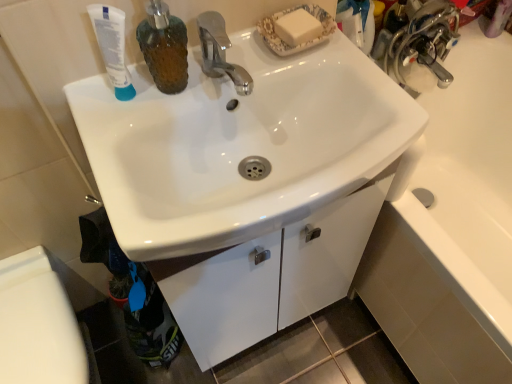
Identify the location of white glossy cabinet at lower center. (270, 276).

In order to face white glossy cabinet at lower center, should I rotate leftwards or rightwards?

A 3.086 degree turn to the left will do.

Describe the element at coordinates (112, 47) in the screenshot. I see `white matte tube at upper left` at that location.

The image size is (512, 384). In order to click on white glossy sink at center in this screenshot , I will do `click(239, 145)`.

Image resolution: width=512 pixels, height=384 pixels. I want to click on white glossy toilet bowl at lower left, so click(38, 324).

Is brown textured soap dispenser at upper left at the back of white glossy toilet bowl at lower left?

No, white glossy toilet bowl at lower left is not facing the opposite direction of brown textured soap dispenser at upper left.

Is white glossy toilet bowl at lower left shorter than brown textured soap dispenser at upper left?

Incorrect, the height of white glossy toilet bowl at lower left does not fall short of that of brown textured soap dispenser at upper left.

Is white glossy toilet bowl at lower left not close to brown textured soap dispenser at upper left?

white glossy toilet bowl at lower left is actually quite close to brown textured soap dispenser at upper left.

From the image's perspective, is white glossy toilet bowl at lower left on top of brown textured soap dispenser at upper left?

No, from the image's perspective, white glossy toilet bowl at lower left is not on top of brown textured soap dispenser at upper left.

How far apart are white matte tube at upper left and white glossy toilet bowl at lower left?

white matte tube at upper left is 21.80 inches away from white glossy toilet bowl at lower left.

Is white matte tube at upper left in front of or behind white glossy toilet bowl at lower left in the image?

white matte tube at upper left is in front of white glossy toilet bowl at lower left.

In terms of height, does white matte tube at upper left look taller or shorter compared to white glossy toilet bowl at lower left?

Considering their sizes, white matte tube at upper left has less height than white glossy toilet bowl at lower left.

In the scene shown: From a real-world perspective, is white glossy toilet bowl at lower left above or below white matte tube at upper left?

white glossy toilet bowl at lower left is situated lower than white matte tube at upper left in the real world.

Is white glossy toilet bowl at lower left bigger or smaller than white matte tube at upper left?

Considering their sizes, white glossy toilet bowl at lower left takes up more space than white matte tube at upper left.

From the image's perspective, who appears lower, white glossy toilet bowl at lower left or white matte tube at upper left?

From the image's view, white glossy toilet bowl at lower left is below.

Based on the photo, which is closer, (63, 317) or (110, 67)?

Positioned in front is point (110, 67).

In the image, is white glossy sink at center on the left side or the right side of white glossy toilet bowl at lower left?

In the image, white glossy sink at center appears on the right side of white glossy toilet bowl at lower left.

From the image's perspective, which is above, white glossy sink at center or white glossy toilet bowl at lower left?

From the image's view, white glossy sink at center is above.

Consider the image. Can you confirm if white glossy sink at center is thinner than white glossy toilet bowl at lower left?

No, white glossy sink at center is not thinner than white glossy toilet bowl at lower left.

Between point (164, 260) and point (47, 280), which one is positioned in front?

The point (164, 260) is more forward.

From a real-world perspective, is white glossy cabinet at lower center on top of white glossy toilet bowl at lower left?

No, from a real-world perspective, white glossy cabinet at lower center is not above white glossy toilet bowl at lower left.

How much distance is there between white glossy cabinet at lower center and white glossy toilet bowl at lower left?

white glossy cabinet at lower center and white glossy toilet bowl at lower left are 16.23 inches apart.

Is white glossy cabinet at lower center shorter than white glossy toilet bowl at lower left?

Correct, white glossy cabinet at lower center is not as tall as white glossy toilet bowl at lower left.

Considering the relative positions of white matte tube at upper left and brown textured soap dispenser at upper left in the image provided, is white matte tube at upper left to the right of brown textured soap dispenser at upper left from the viewer's perspective?

No.

Consider the image. Does white matte tube at upper left have a lesser width compared to brown textured soap dispenser at upper left?

Yes.

Looking at this image, how different are the orientations of white matte tube at upper left and brown textured soap dispenser at upper left in degrees?

white matte tube at upper left and brown textured soap dispenser at upper left are facing 0.00573 degrees away from each other.

From a real-world perspective, is white matte tube at upper left located beneath brown textured soap dispenser at upper left?

Yes, from a real-world perspective, white matte tube at upper left is beneath brown textured soap dispenser at upper left.

Looking at this image, is white glossy sink at center touching white matte tube at upper left?

No, white glossy sink at center is not making contact with white matte tube at upper left.

Is white glossy sink at center aimed at white matte tube at upper left?

No, white glossy sink at center does not turn towards white matte tube at upper left.

Which is more to the left, white glossy sink at center or white matte tube at upper left?

Positioned to the left is white matte tube at upper left.

From a real-world perspective, who is located higher, white glossy sink at center or white matte tube at upper left?

In real-world perspective, white matte tube at upper left is above.

You are a GUI agent. You are given a task and a screenshot of the screen. Output one action in this format:
    pyautogui.click(x=<x>, y=<y>)
    Task: Click on the soap dispenser on the right of white glossy toilet bowl at lower left
    
    Given the screenshot: What is the action you would take?
    pyautogui.click(x=164, y=47)

Identify the location of toothpaste above the white glossy toilet bowl at lower left (from a real-world perspective). (112, 47).

Estimate the real-world distances between objects in this image. Which object is closer to white glossy toilet bowl at lower left, brown textured soap dispenser at upper left or white glossy sink at center?

Based on the image, white glossy sink at center appears to be nearer to white glossy toilet bowl at lower left.

Looking at the image, which one is located further to white glossy toilet bowl at lower left, white glossy sink at center or brown textured soap dispenser at upper left?

brown textured soap dispenser at upper left lies further to white glossy toilet bowl at lower left than the other object.

Based on their spatial positions, is white matte tube at upper left or white glossy toilet bowl at lower left further from brown textured soap dispenser at upper left?

The object further to brown textured soap dispenser at upper left is white glossy toilet bowl at lower left.

Looking at the image, which one is located closer to white glossy toilet bowl at lower left, white glossy cabinet at lower center or white matte tube at upper left?

white glossy cabinet at lower center is closer to white glossy toilet bowl at lower left.

Which object lies nearer to the anchor point white glossy cabinet at lower center, brown textured soap dispenser at upper left or white glossy sink at center?

white glossy sink at center is closer to white glossy cabinet at lower center.

Which object lies further to the anchor point white glossy toilet bowl at lower left, brown textured soap dispenser at upper left or white matte tube at upper left?

Based on the image, brown textured soap dispenser at upper left appears to be further to white glossy toilet bowl at lower left.

When comparing their distances from white glossy cabinet at lower center, does white matte tube at upper left or white glossy sink at center seem closer?

Among the two, white glossy sink at center is located nearer to white glossy cabinet at lower center.

Based on their spatial positions, is white glossy cabinet at lower center or white glossy sink at center further from white glossy toilet bowl at lower left?

white glossy sink at center lies further to white glossy toilet bowl at lower left than the other object.

Image resolution: width=512 pixels, height=384 pixels. I want to click on toilet bowl between white matte tube at upper left and white glossy cabinet at lower center in the vertical direction, so click(x=38, y=324).

Where is `sink between white matte tube at upper left and white glossy cabinet at lower center in the vertical direction`? This screenshot has width=512, height=384. sink between white matte tube at upper left and white glossy cabinet at lower center in the vertical direction is located at coordinates (239, 145).

Image resolution: width=512 pixels, height=384 pixels. Identify the location of soap dispenser between white matte tube at upper left and white glossy sink at center in the horizontal direction. (164, 47).

Where is `sink between brown textured soap dispenser at upper left and white glossy toilet bowl at lower left in the vertical direction`? The height and width of the screenshot is (384, 512). sink between brown textured soap dispenser at upper left and white glossy toilet bowl at lower left in the vertical direction is located at coordinates (239, 145).